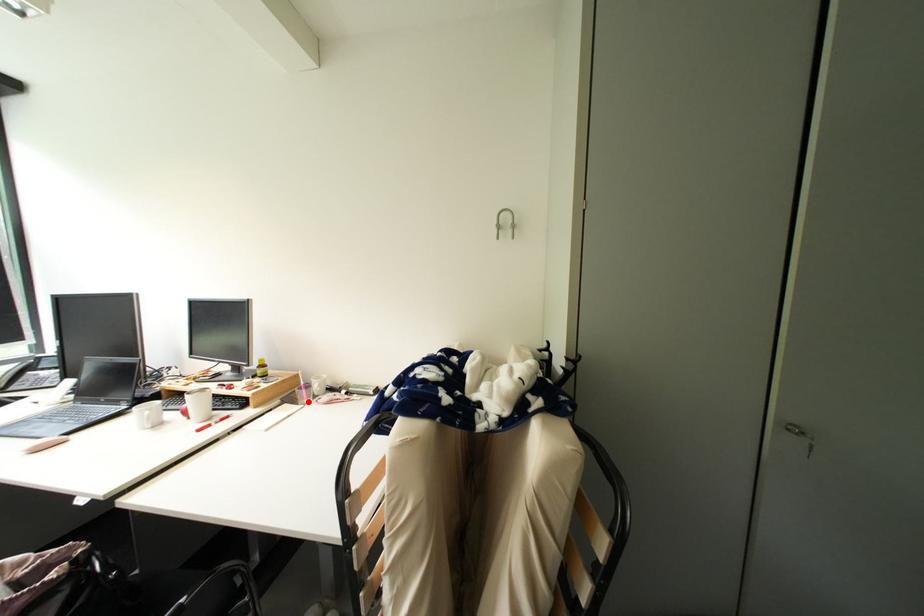
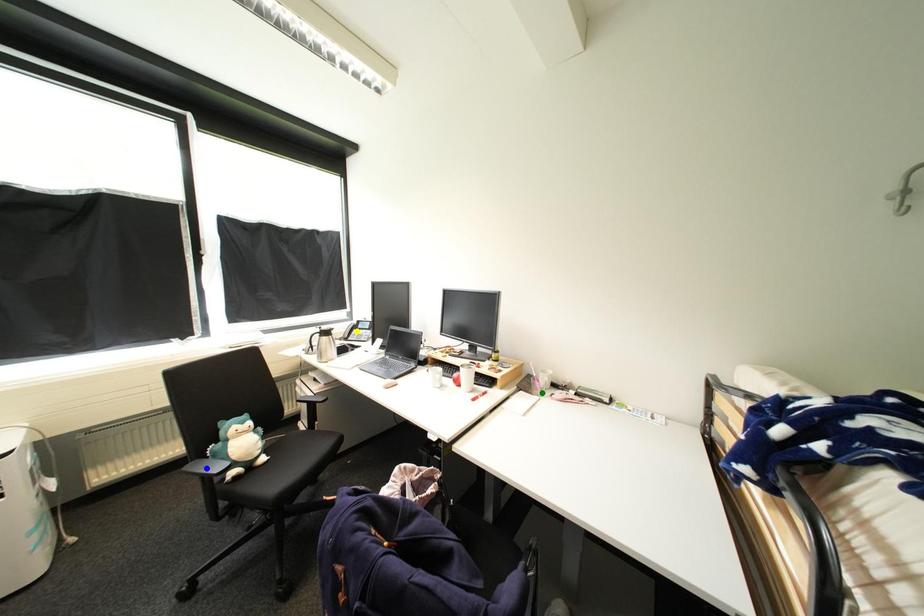
Question: I am providing you with two images of the same scene from different viewpoints. A red point is marked on the first image. You are given multiple points on the second image. Which point in image 2 is actually the same real-world point as the red point in image 1?

Choices:
 (A) blue point
 (B) green point
 (C) yellow point

Answer: (B)